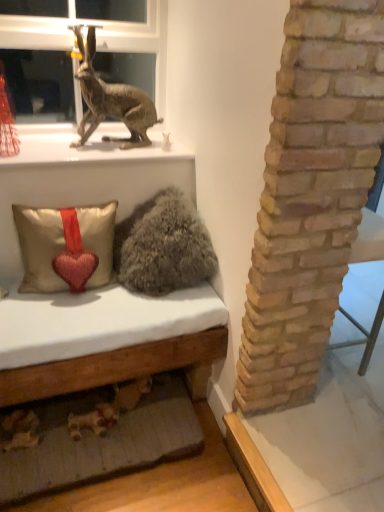
You are a GUI agent. You are given a task and a screenshot of the screen. Output one action in this format:
    pyautogui.click(x=<x>, y=<y>)
    Task: Click on the free space in front of satin beige pillow with heart at lower left
    The width and height of the screenshot is (384, 512).
    Given the screenshot: What is the action you would take?
    pyautogui.click(x=61, y=321)